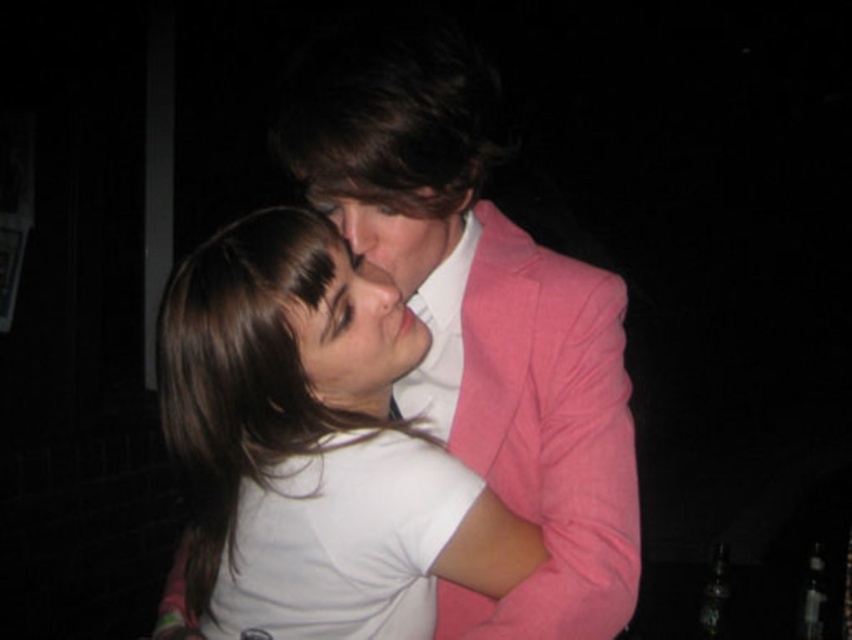
You are a photographer adjusting lighting for a portrait. You notice the matte white face at center and the matte pink blazer at center in your frame. Which object should you focus on to ensure proper exposure since it takes up more space in the image?

The matte white face at center is larger in size than the matte pink blazer at center, so you should focus on the matte white face at center for proper exposure as it occupies more space in the image.

You are a photographer adjusting the lighting for a portrait. You notice the white matte shirt at center and the matte white face at center in your frame. Which object should you focus your spotlight on to ensure it stands out more due to its size?

The white matte shirt at center should be the focus since its width is larger than the matte white face at center, making it more prominent in the frame.